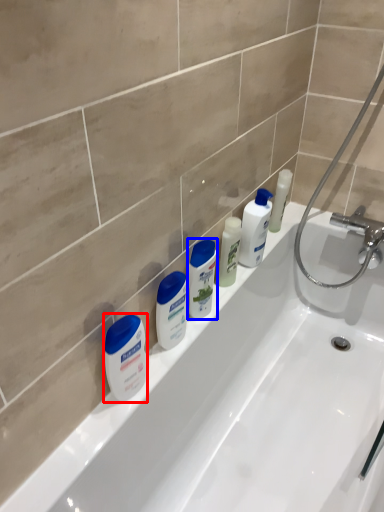
Question: Which object appears farthest to the camera in this image, cleaning product (highlighted by a red box) or toiletry (highlighted by a blue box)?

Choices:
 (A) cleaning product
 (B) toiletry

Answer: (B)